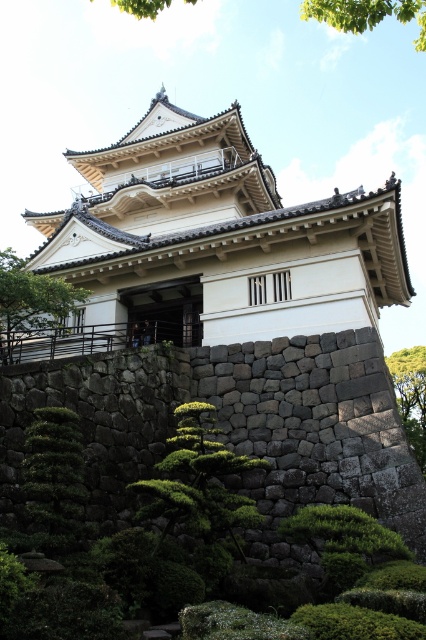
Is point (178, 500) positioned in front of point (37, 429)?

Yes, point (178, 500) is in front of point (37, 429).

Between green leafy bush at lower center and green leafy bush at lower left, which one has more height?

green leafy bush at lower center

Locate an element on the screen. Image resolution: width=426 pixels, height=640 pixels. green leafy bush at lower center is located at coordinates (198, 481).

Which of these two, green leafy bush at lower left or green leafy tree at upper center, stands shorter?

Standing shorter between the two is green leafy bush at lower left.

Does point (42, 452) come closer to viewer compared to point (304, 6)?

Yes, it is in front of point (304, 6).

What do you see at coordinates (54, 481) in the screenshot?
I see `green leafy bush at lower left` at bounding box center [54, 481].

At what (x,y) coordinates should I click in order to perform the action: click on green leafy bush at lower left. Please return your answer as a coordinate pair (x, y). Looking at the image, I should click on (54, 481).

Between green leafy tree at upper center and green leafy tree at center-right, which one appears on the left side from the viewer's perspective?

green leafy tree at upper center

Which of these two, green leafy tree at upper center or green leafy tree at center-right, stands shorter?

Standing shorter between the two is green leafy tree at center-right.

Who is more distant from viewer, (189, 1) or (423, 464)?

Positioned behind is point (189, 1).

Locate an element on the screen. This screenshot has height=640, width=426. green leafy tree at upper center is located at coordinates (365, 13).